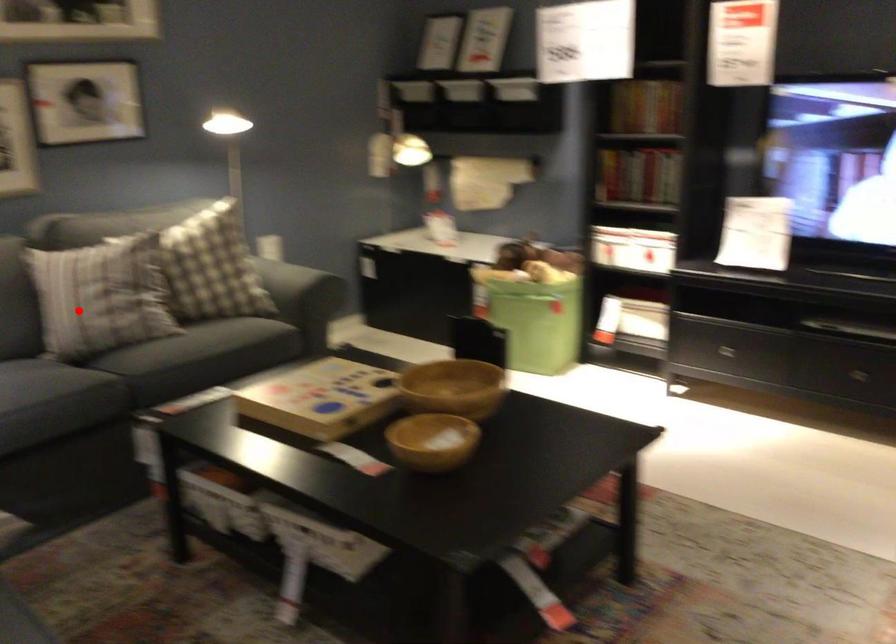
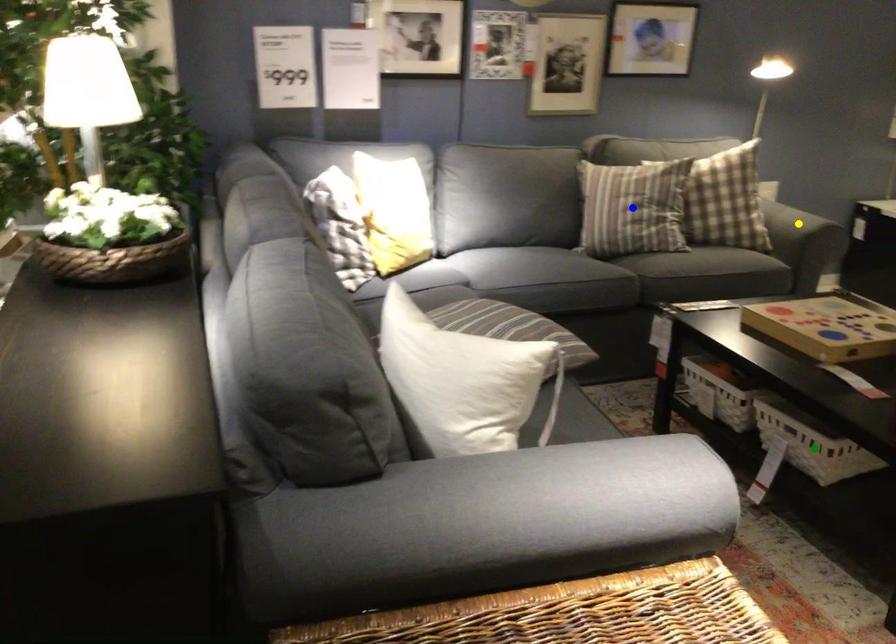
Question: I am providing you with two images of the same scene from different viewpoints. A red point is marked on the first image. You are given multiple points on the second image. Which point in image 2 represents the same 3d spot as the red point in image 1?

Choices:
 (A) green point
 (B) yellow point
 (C) blue point

Answer: (C)